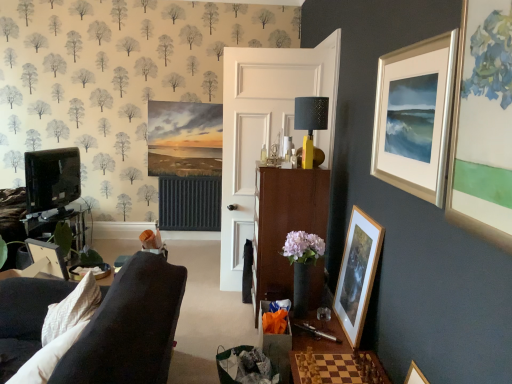
Question: Does wooden picture frame at left, which is the 1th picture frame in left-to-right order, have a greater width compared to matte black tv stand at left?

Choices:
 (A) no
 (B) yes

Answer: (A)

Question: Are wooden picture frame at left, the 2th picture frame in the top-to-bottom sequence, and matte black tv stand at left located far from each other?

Choices:
 (A) yes
 (B) no

Answer: (A)

Question: Is wooden picture frame at left, the second picture frame when ordered from bottom to top, taller than matte black tv stand at left?

Choices:
 (A) yes
 (B) no

Answer: (B)

Question: Is wooden picture frame at left, the 2th picture frame in the top-to-bottom sequence, outside matte black tv stand at left?

Choices:
 (A) yes
 (B) no

Answer: (A)

Question: Is wooden picture frame at left, the second picture frame when ordered from bottom to top, beside matte black tv stand at left?

Choices:
 (A) yes
 (B) no

Answer: (B)

Question: In terms of size, does wooden chessboard at lower center appear bigger or smaller than wooden picture frame at left, the second picture frame when ordered from bottom to top?

Choices:
 (A) big
 (B) small

Answer: (A)

Question: Looking at their shapes, would you say wooden chessboard at lower center is wider or thinner than wooden picture frame at left, the second picture frame when ordered from bottom to top?

Choices:
 (A) thin
 (B) wide

Answer: (B)

Question: Is wooden chessboard at lower center inside the boundaries of wooden picture frame at left, the 3th picture frame when ordered from right to left, or outside?

Choices:
 (A) inside
 (B) outside

Answer: (B)

Question: From the image's perspective, is wooden chessboard at lower center located above or below wooden picture frame at left, which is the 1th picture frame in left-to-right order?

Choices:
 (A) below
 (B) above

Answer: (A)

Question: From the image's perspective, is wooden picture frame at lower right, acting as the 3th picture frame starting from the top, located above or below wooden picture frame at left, the 2th picture frame in the top-to-bottom sequence?

Choices:
 (A) above
 (B) below

Answer: (B)

Question: From a real-world perspective, is wooden picture frame at lower right, which is the first picture frame in bottom-to-top order, physically located above or below wooden picture frame at left, the second picture frame when ordered from bottom to top?

Choices:
 (A) above
 (B) below

Answer: (B)

Question: Considering the positions of wooden picture frame at lower right, the second picture frame in the left-to-right sequence, and wooden picture frame at left, the 2th picture frame in the top-to-bottom sequence, in the image, is wooden picture frame at lower right, the second picture frame in the left-to-right sequence, wider or thinner than wooden picture frame at left, the 2th picture frame in the top-to-bottom sequence,?

Choices:
 (A) thin
 (B) wide

Answer: (A)

Question: From their relative heights in the image, would you say wooden picture frame at lower right, the second picture frame in the left-to-right sequence, is taller or shorter than wooden picture frame at left, the second picture frame when ordered from bottom to top?

Choices:
 (A) short
 (B) tall

Answer: (B)

Question: Visually, is yellow matte/black textured lampshade at center positioned to the left or to the right of matte black tv stand at left?

Choices:
 (A) left
 (B) right

Answer: (B)

Question: Which is correct: yellow matte/black textured lampshade at center is inside matte black tv stand at left, or outside of it?

Choices:
 (A) outside
 (B) inside

Answer: (A)